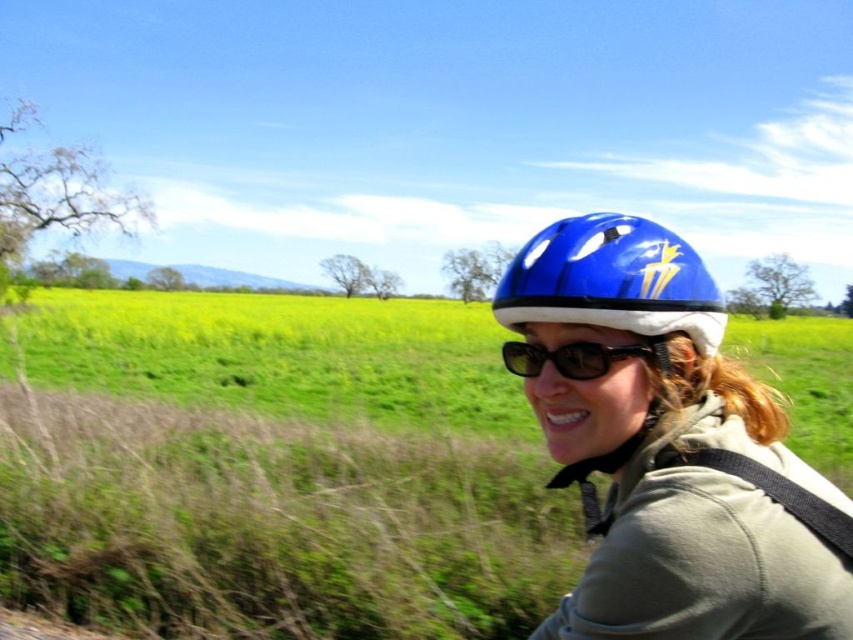
You are standing at the point with coordinates point [532,348] and want to walk to the point with coordinates point [361,362]. According to the scene, will the path between them be clear of any obstacles?

Point [361,362] is behind point [532,348], so the path between them is clear of obstacles.